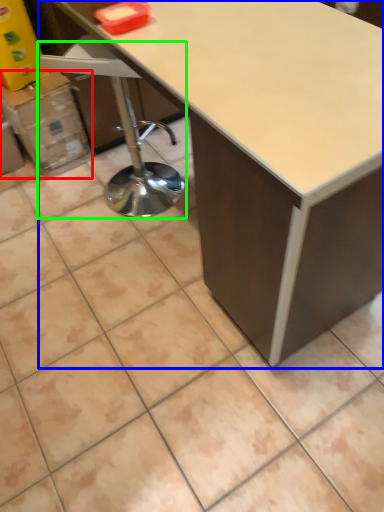
Question: Estimate the real-world distances between objects in this image. Which object is closer to cardboard box (highlighted by a red box), table (highlighted by a blue box) or swivel chair (highlighted by a green box)?

Choices:
 (A) table
 (B) swivel chair

Answer: (B)